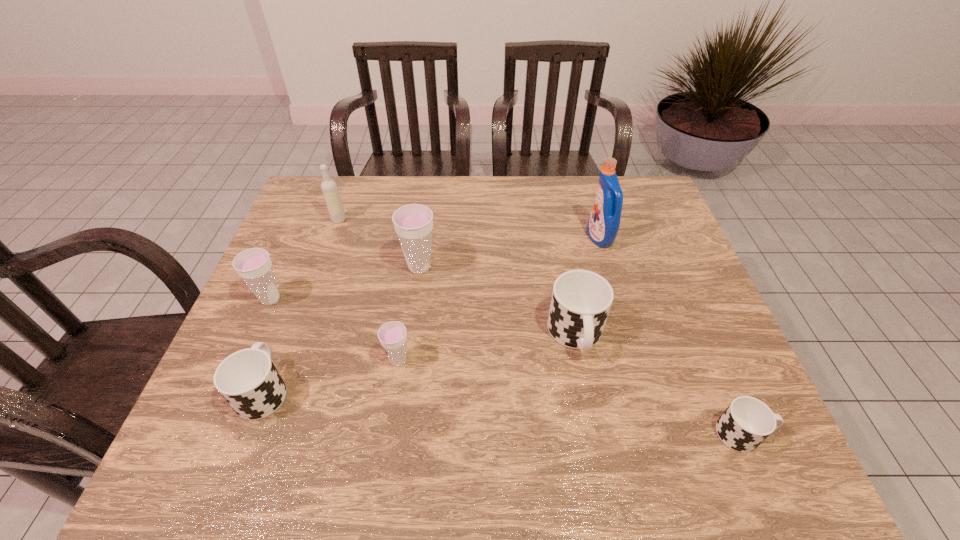
Image resolution: width=960 pixels, height=540 pixels. In order to click on vacant area that lies between the biggest purple cup and the rightmost cup in this screenshot , I will do `click(581, 350)`.

Where is `vacant region between the biggest black cup and the leftmost black cup`? This screenshot has height=540, width=960. vacant region between the biggest black cup and the leftmost black cup is located at coordinates (420, 362).

This screenshot has height=540, width=960. I want to click on free area in between the leftmost purple cup and the white vodka, so click(304, 259).

The height and width of the screenshot is (540, 960). I want to click on blank region between the farthest cup and the second black cup from left to right, so click(497, 301).

The image size is (960, 540). In order to click on free spot between the second smallest black cup and the tallest cup in this screenshot , I will do `click(342, 328)`.

Where is `free spot between the nearest purple cup and the rightmost cup`? The width and height of the screenshot is (960, 540). free spot between the nearest purple cup and the rightmost cup is located at coordinates (571, 397).

Locate an element on the screen. The width and height of the screenshot is (960, 540). object that is the sixth closest to the second farthest purple cup is located at coordinates (603, 225).

Find the location of a particular element. The width and height of the screenshot is (960, 540). the third closest object to the second black cup from left to right is located at coordinates (413, 223).

Select which cup appears as the second closest to the farthest cup. Please provide its 2D coordinates. Your answer should be formatted as a tuple, i.e. [(x, y)], where the tuple contains the x and y coordinates of a point satisfying the conditions above.

[(253, 265)]

Image resolution: width=960 pixels, height=540 pixels. What are the coordinates of `cup that stands as the fifth closest to the nearest purple cup` in the screenshot? It's located at (747, 422).